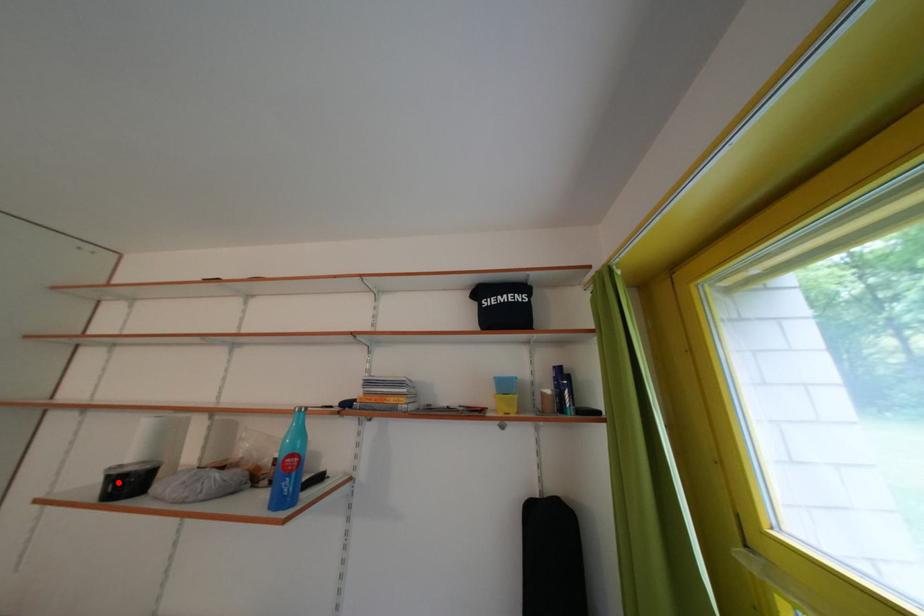
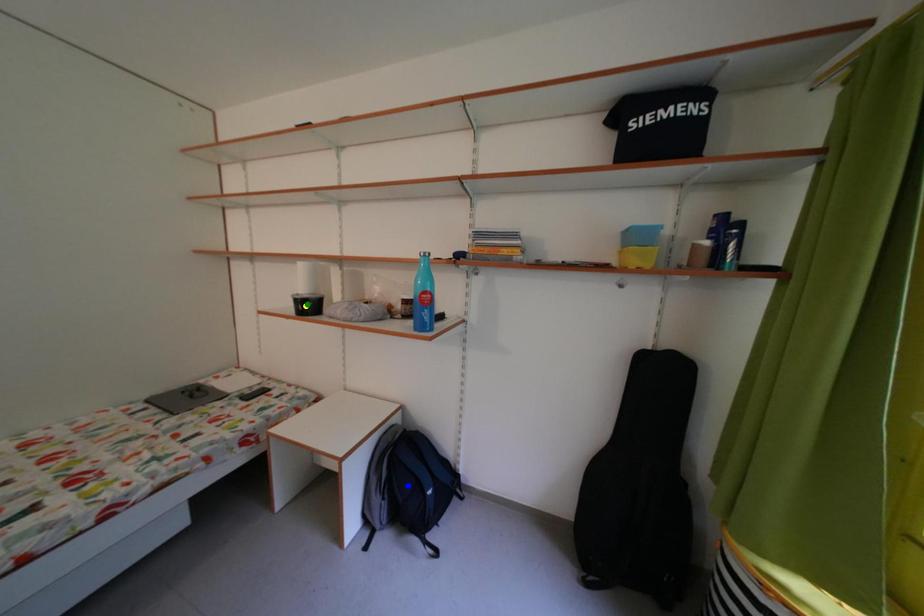
Question: I am providing you with two images of the same scene from different viewpoints. A red point is marked on the first image. You are given multiple points on the second image. In image 2, which mark is for the same physical point as the one in image 1?

Choices:
 (A) blue point
 (B) yellow point
 (C) green point

Answer: (B)